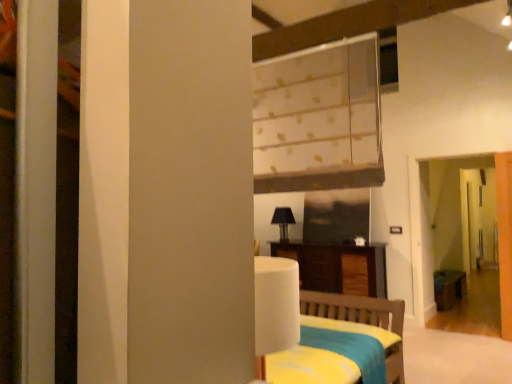
At what (x,y) coordinates should I click in order to perform the action: click on blank space above white textured blinds at upper center (from a real-world perspective). Please return your answer as a coordinate pair (x, y). Image resolution: width=512 pixels, height=384 pixels. Looking at the image, I should click on (309, 38).